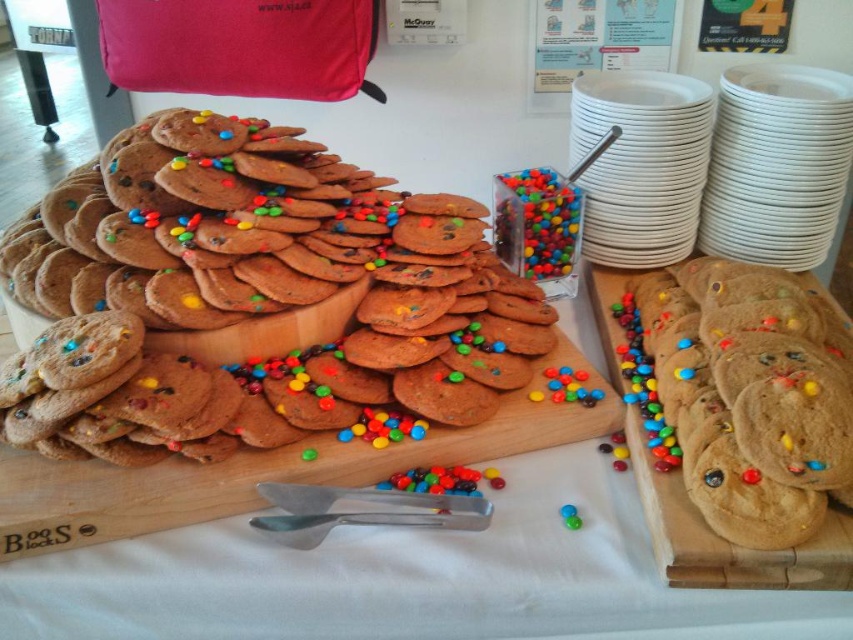
Question: Can you confirm if brown matte cookie at center is positioned above brown wooden board at center?

Choices:
 (A) no
 (B) yes

Answer: (B)

Question: Which object is closer to the camera taking this photo?

Choices:
 (A) brown wooden board at center
 (B) brown matte cookie at center

Answer: (A)

Question: Which of these objects is positioned farthest from the chocolate chip cookies at center?

Choices:
 (A) brown wooden board at center
 (B) brown matte cookie at center

Answer: (A)

Question: Which object is positioned closest to the chocolate chip cookies at center?

Choices:
 (A) brown matte cookie at center
 (B) brown wooden board at center

Answer: (A)

Question: Does chocolate chip cookies at center appear on the left side of brown wooden board at center?

Choices:
 (A) yes
 (B) no

Answer: (A)

Question: From the image, what is the correct spatial relationship of brown matte cookie at center in relation to brown wooden board at center?

Choices:
 (A) right
 (B) left

Answer: (A)